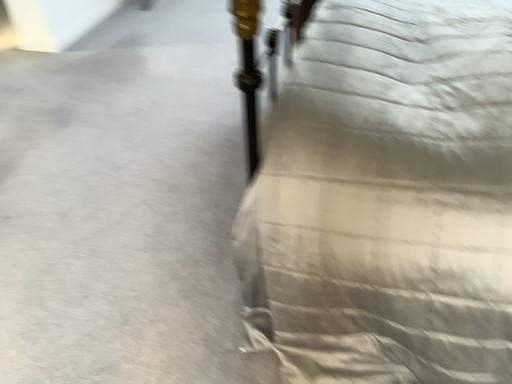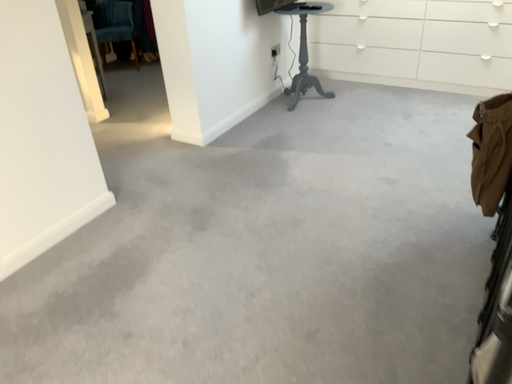
Question: Which way did the camera rotate in the video?

Choices:
 (A) rotated downward
 (B) rotated upward

Answer: (B)